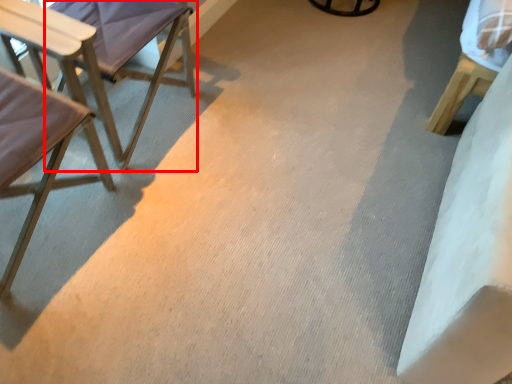
Question: Considering the relative positions of chair (annotated by the red box) and chair in the image provided, where is chair (annotated by the red box) located with respect to the staircase?

Choices:
 (A) left
 (B) right

Answer: (B)